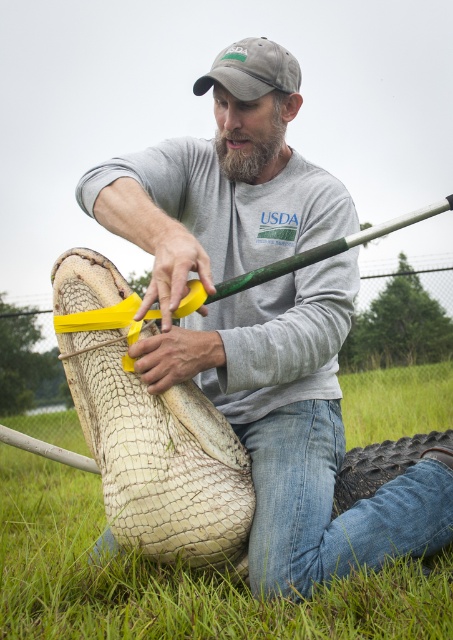
Question: Does leather textured boot at center appear on the right side of gray fabric cap at upper center?

Choices:
 (A) yes
 (B) no

Answer: (B)

Question: Which point is farther to the camera?

Choices:
 (A) gray fabric cap at upper center
 (B) leather textured boot at center

Answer: (A)

Question: Considering the relative positions of leather textured boot at center and gray fabric cap at upper center in the image provided, where is leather textured boot at center located with respect to gray fabric cap at upper center?

Choices:
 (A) below
 (B) above

Answer: (A)

Question: Which of the following is the closest to the observer?

Choices:
 (A) gray fabric cap at upper center
 (B) leather textured boot at center

Answer: (B)

Question: Is leather textured boot at center below gray fabric cap at upper center?

Choices:
 (A) no
 (B) yes

Answer: (B)

Question: Which of the following is the closest to the observer?

Choices:
 (A) leather textured boot at center
 (B) gray fabric cap at upper center

Answer: (A)